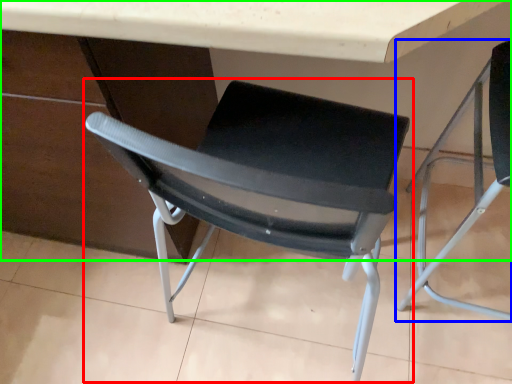
Question: Considering the real-world distances, which object is farthest from chair (highlighted by a red box)? chair (highlighted by a blue box) or table (highlighted by a green box)?

Choices:
 (A) chair
 (B) table

Answer: (A)